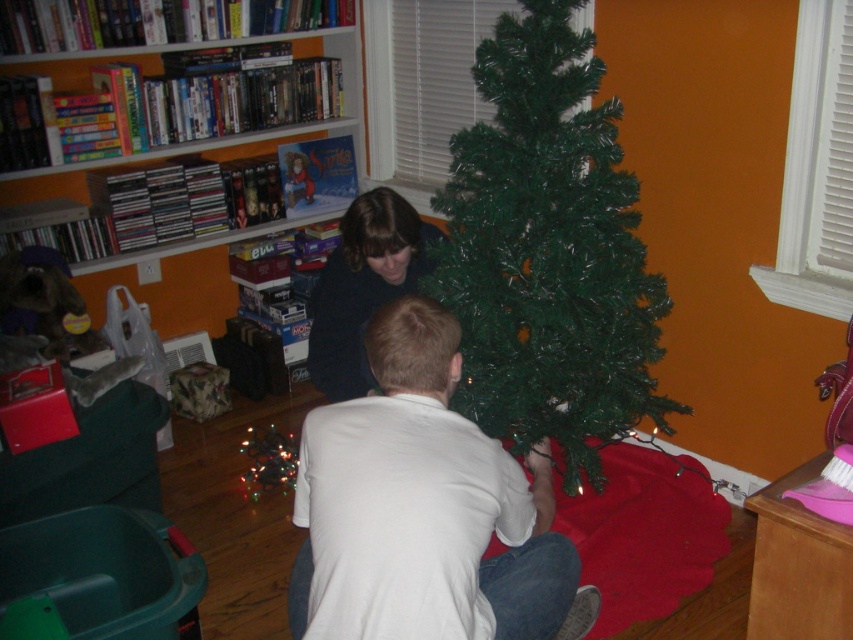
You are planning to place a new decoration on the green artificial christmas tree at center. Considering the size of the white matte shirt at center, can you estimate if the decoration will fit on the tree?

The green artificial christmas tree at center is larger than the white matte shirt at center, so the decoration should fit comfortably on the tree.

You are a guest at a holiday party and see the white matte shirt at center and the wooden bookshelf at upper left. Which object is closer to you?

The white matte shirt at center is closer to you because it is in front of the wooden bookshelf at upper left.